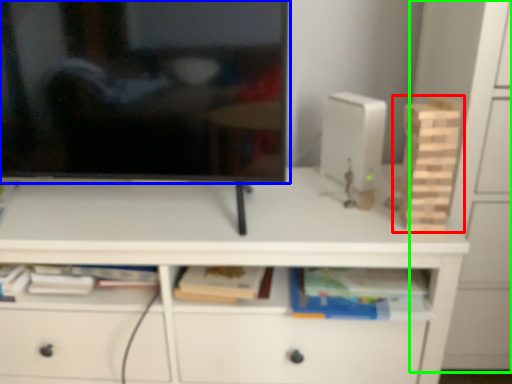
Question: Considering the real-world distances, which object is farthest from toy (highlighted by a red box)? television (highlighted by a blue box) or cabinetry (highlighted by a green box)?

Choices:
 (A) television
 (B) cabinetry

Answer: (A)